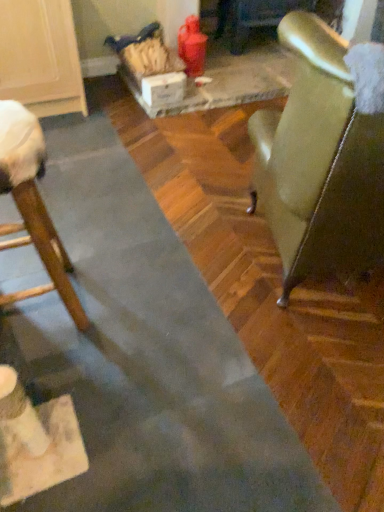
Question: Is wooden chair at left, arranged as the second chair when viewed from the right, inside the boundaries of leather-like green chair at right, the first chair when ordered from right to left, or outside?

Choices:
 (A) outside
 (B) inside

Answer: (A)

Question: Looking at the image, does wooden chair at left, arranged as the second chair when viewed from the right, seem bigger or smaller compared to leather-like green chair at right, arranged as the 2th chair when viewed from the left?

Choices:
 (A) big
 (B) small

Answer: (B)

Question: Which object is the closest to the wooden chair at left, arranged as the second chair when viewed from the right?

Choices:
 (A) leather-like green chair at right, arranged as the 2th chair when viewed from the left
 (B) white cardboard box at center

Answer: (A)

Question: Considering the real-world distances, which object is farthest from the wooden chair at left, arranged as the second chair when viewed from the right?

Choices:
 (A) leather-like green chair at right, the first chair when ordered from right to left
 (B) white cardboard box at center

Answer: (B)